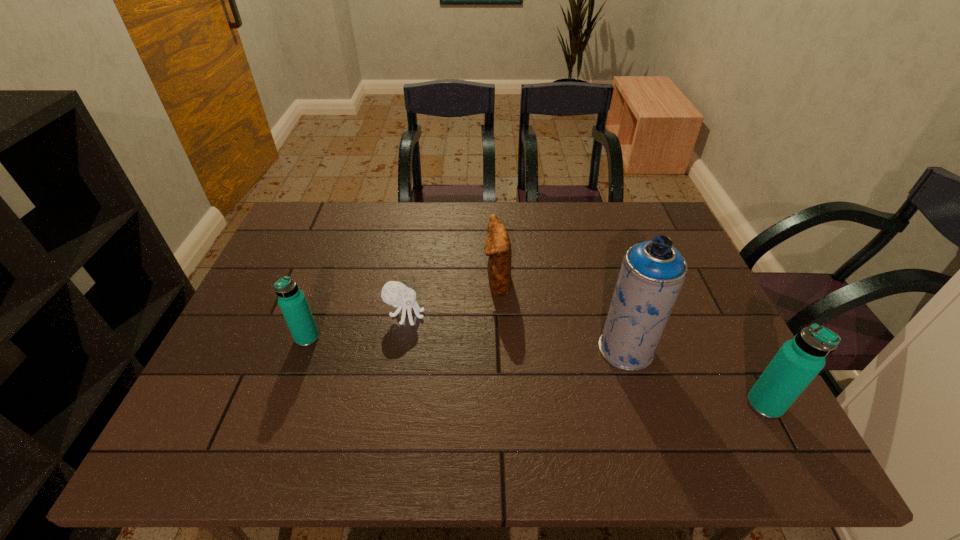
Where is `empty space that is in between the farther water bottle and the nearer water bottle`? The height and width of the screenshot is (540, 960). empty space that is in between the farther water bottle and the nearer water bottle is located at coordinates (536, 371).

Find the location of a particular element. unoccupied position between the farther water bottle and the fourth object from left to right is located at coordinates (467, 343).

The height and width of the screenshot is (540, 960). Identify the location of empty space between the taller water bottle and the shorter water bottle. (536, 371).

The image size is (960, 540). In order to click on free space between the farther water bottle and the farthest object in this screenshot , I will do `click(402, 310)`.

This screenshot has height=540, width=960. What are the coordinates of `vacant area that lies between the fourth object from left to right and the third object from right to left` in the screenshot? It's located at (562, 315).

Where is `vacant space that's between the farther water bottle and the rightmost object`? The image size is (960, 540). vacant space that's between the farther water bottle and the rightmost object is located at coordinates (536, 371).

Image resolution: width=960 pixels, height=540 pixels. Identify the location of object that is the closest to the third object from left to right. (394, 293).

Choose which object is the nearest neighbor to the nearest object. Please provide its 2D coordinates. Your answer should be formatted as a tuple, i.e. [(x, y)], where the tuple contains the x and y coordinates of a point satisfying the conditions above.

[(652, 273)]

I want to click on vacant space that satisfies the following two spatial constraints: 1. on the back side of the taller water bottle; 2. on the front-facing side of the shortest object, so point(718,315).

This screenshot has height=540, width=960. What are the coordinates of `vacant region that satisfies the following two spatial constraints: 1. on the open side of the clutch bag; 2. on the left side of the aerosol can` in the screenshot? It's located at (500, 349).